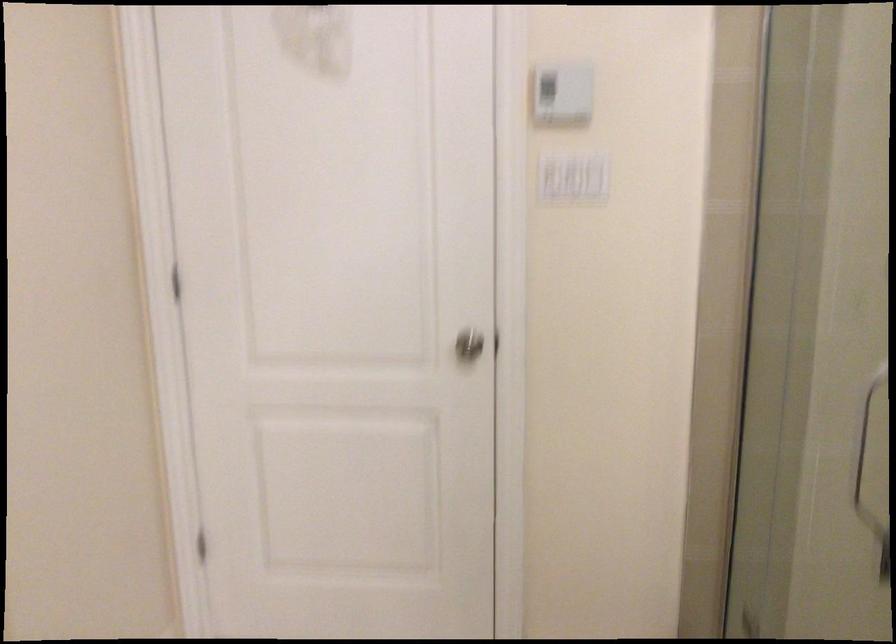
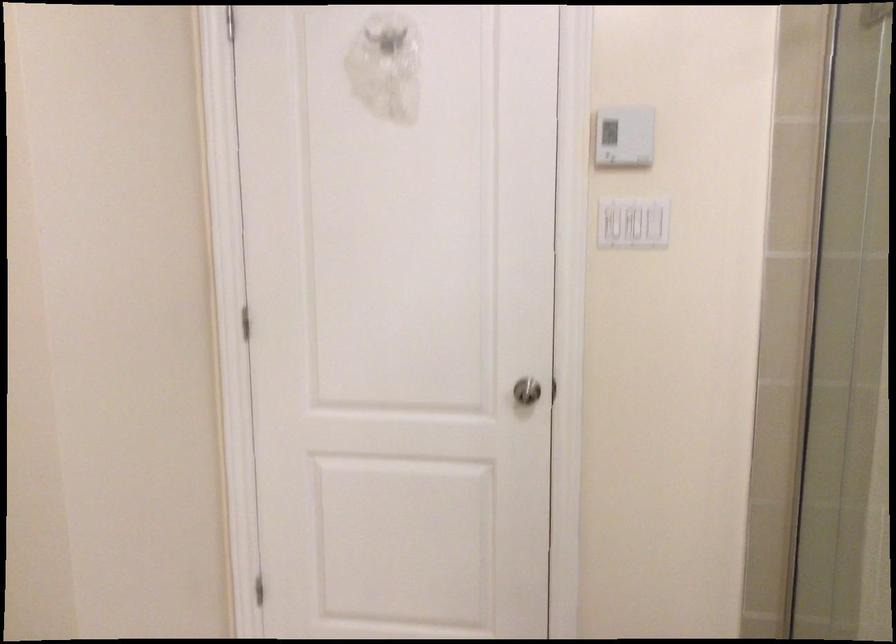
Locate, in the second image, the point that corresponds to [574,129] in the first image.

(633, 223)